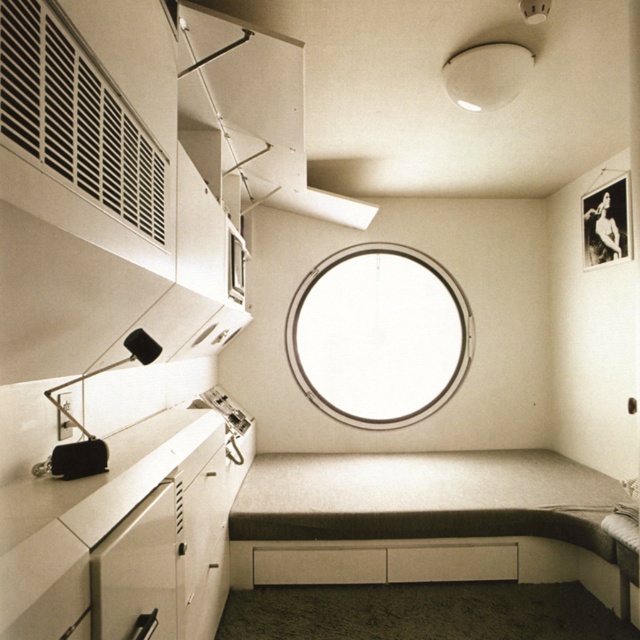
Is point (49, 122) closer to viewer compared to point (156, 346)?

Yes.

Who is higher up, black vent at upper left or matte black lamp at left?

black vent at upper left is higher up.

Which is in front, point (29, 92) or point (102, 468)?

Point (29, 92) is in front.

Find the location of a particular element. The width and height of the screenshot is (640, 640). black vent at upper left is located at coordinates (76, 120).

Find the location of a particular element. The height and width of the screenshot is (640, 640). white glass window at center is located at coordinates (378, 336).

Who is more forward, [444,312] or [230,228]?

Positioned in front is point [230,228].

Is point (321, 268) positioned in front of point (240, 253)?

No, (321, 268) is behind (240, 253).

Where is `white glass window at center`? Image resolution: width=640 pixels, height=640 pixels. white glass window at center is located at coordinates (378, 336).

Is black vent at upper left closer to camera compared to transparent glass window at center?

That is True.

Does black vent at upper left have a larger size compared to transparent glass window at center?

Correct, black vent at upper left is larger in size than transparent glass window at center.

Is point (22, 54) positioned after point (236, 294)?

No, (22, 54) is closer to viewer.

Identify the location of black vent at upper left. (76, 120).